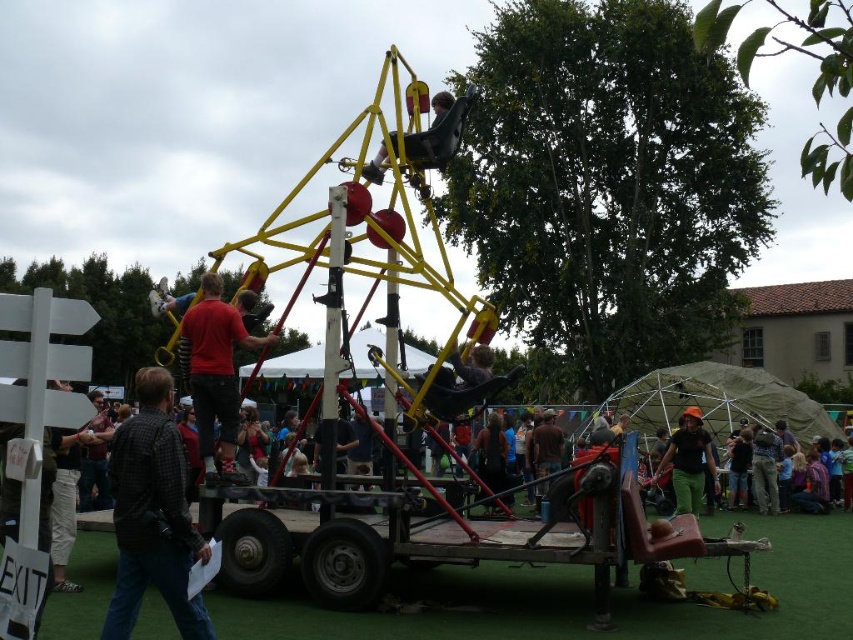
You are standing at the fair and want to take a photo of the two points mentioned in the scene. Which point, point (167,604) or point (228,476), will appear larger in your camera view?

Point (167,604) is closer to the viewer than point (228,476), so it will appear larger in the camera view.